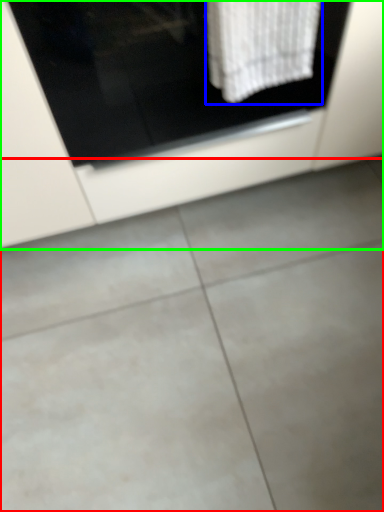
Question: Which object is the closest to the concrete (highlighted by a red box)? Choose among these: bath towel (highlighted by a blue box) or cabinetry (highlighted by a green box).

Choices:
 (A) bath towel
 (B) cabinetry

Answer: (B)